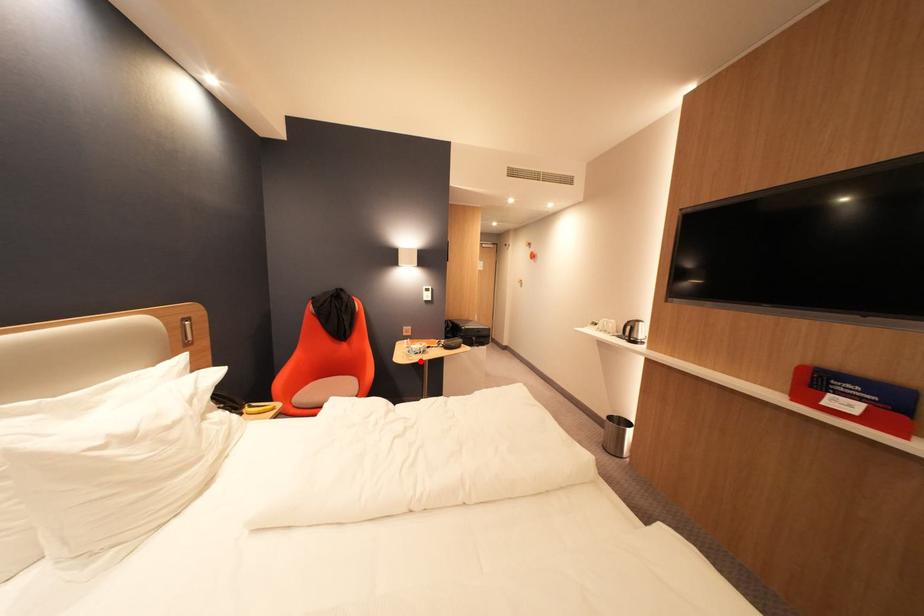
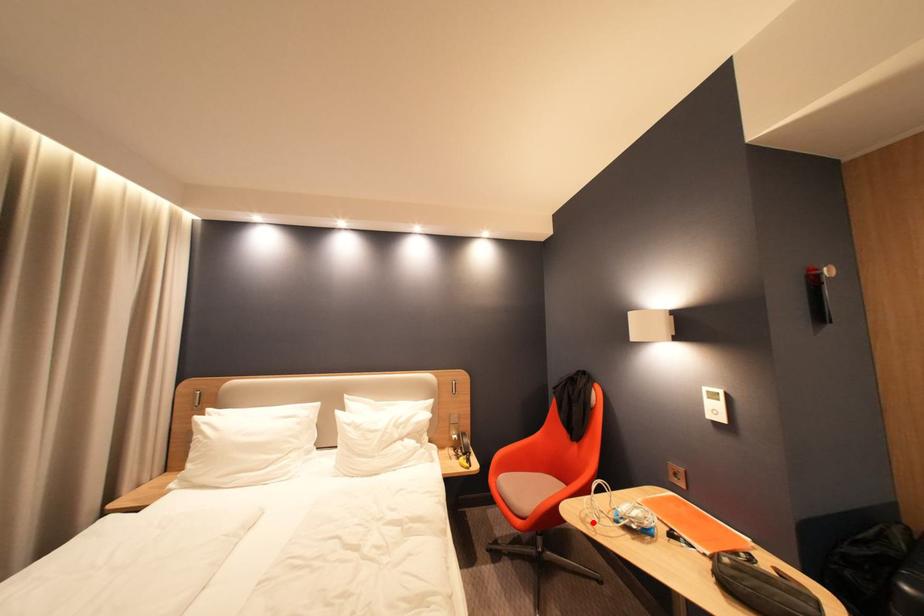
I am providing you with two images of the same scene from different viewpoints. A red point is marked on the first image and another point is marked on the second image. Do the highlighted points in image1 and image2 indicate the same real-world spot?

Yes